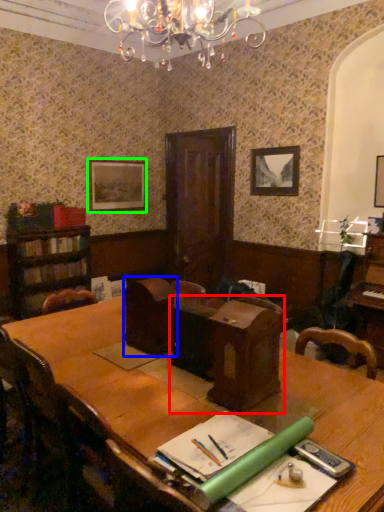
Question: Based on their relative distances, which object is nearer to computer desk (highlighted by a red box)? Choose from armchair (highlighted by a blue box) and picture frame (highlighted by a green box).

Choices:
 (A) armchair
 (B) picture frame

Answer: (A)